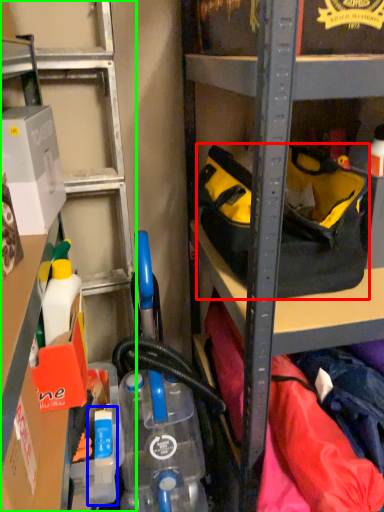
Question: Based on their relative distances, which object is farther from handbag (highlighted by a red box)? Choose from bottle (highlighted by a blue box) and shelf (highlighted by a green box).

Choices:
 (A) bottle
 (B) shelf

Answer: (A)